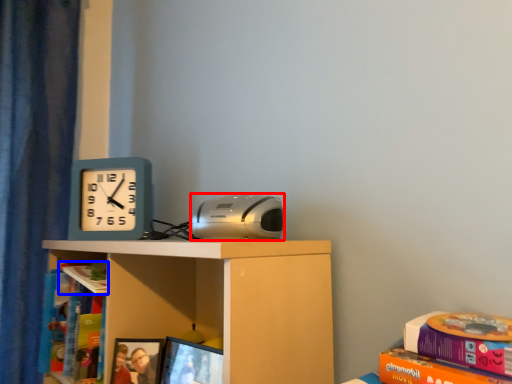
Question: Which object appears closest to the camera in this image, stereo (highlighted by a red box) or book (highlighted by a blue box)?

Choices:
 (A) stereo
 (B) book

Answer: (A)